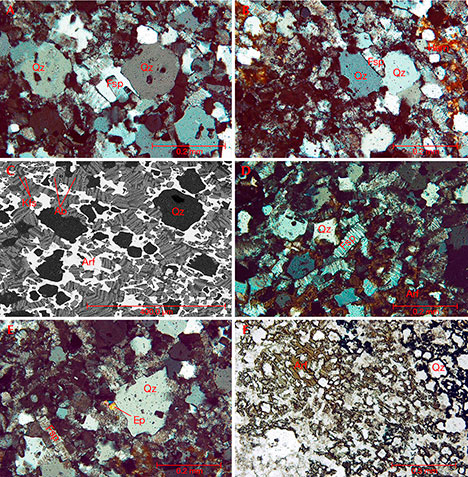
Where is `scales`? This screenshot has width=468, height=477. scales is located at coordinates (189, 472), (157, 309), (182, 151), (416, 148), (421, 312), (423, 471).